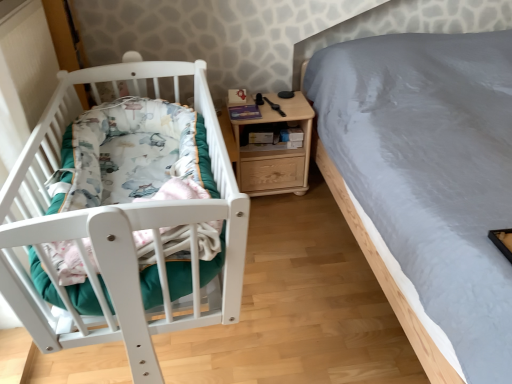
Question: Is light wood/texture nightstand at center far away from white matte crib at left?

Choices:
 (A) no
 (B) yes

Answer: (A)

Question: From the image's perspective, is light wood/texture nightstand at center beneath white matte crib at left?

Choices:
 (A) yes
 (B) no

Answer: (B)

Question: Can you confirm if light wood/texture nightstand at center is wider than white matte crib at left?

Choices:
 (A) no
 (B) yes

Answer: (A)

Question: Is light wood/texture nightstand at center further to the viewer compared to white matte crib at left?

Choices:
 (A) no
 (B) yes

Answer: (B)

Question: Is light wood/texture nightstand at center shorter than white matte crib at left?

Choices:
 (A) yes
 (B) no

Answer: (B)

Question: Is white matte crib at left completely or partially inside light wood/texture nightstand at center?

Choices:
 (A) yes
 (B) no

Answer: (B)

Question: Is light wood/texture nightstand at center located within white matte crib at left?

Choices:
 (A) no
 (B) yes

Answer: (A)

Question: From the image's perspective, is white matte crib at left located beneath light wood/texture nightstand at center?

Choices:
 (A) yes
 (B) no

Answer: (A)

Question: Is white matte crib at left far from light wood/texture nightstand at center?

Choices:
 (A) no
 (B) yes

Answer: (A)

Question: Considering the relative positions of white matte crib at left and light wood/texture nightstand at center in the image provided, is white matte crib at left to the left of light wood/texture nightstand at center from the viewer's perspective?

Choices:
 (A) yes
 (B) no

Answer: (A)

Question: Is white matte crib at left thinner than light wood/texture nightstand at center?

Choices:
 (A) no
 (B) yes

Answer: (A)

Question: Is white matte crib at left oriented away from light wood/texture nightstand at center?

Choices:
 (A) no
 (B) yes

Answer: (A)

Question: From a real-world perspective, is white matte crib at left positioned above or below light wood/texture nightstand at center?

Choices:
 (A) below
 (B) above

Answer: (B)